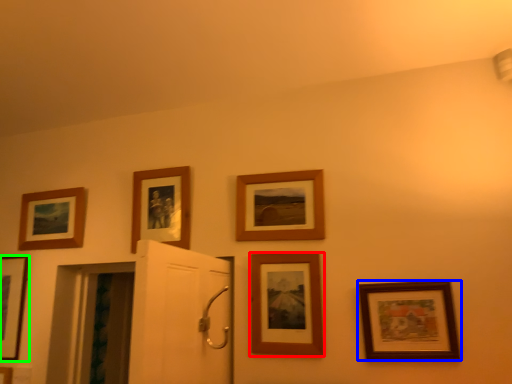
Question: Considering the real-world distances, which object is farthest from picture frame (highlighted by a red box)? picture frame (highlighted by a blue box) or picture frame (highlighted by a green box)?

Choices:
 (A) picture frame
 (B) picture frame

Answer: (B)